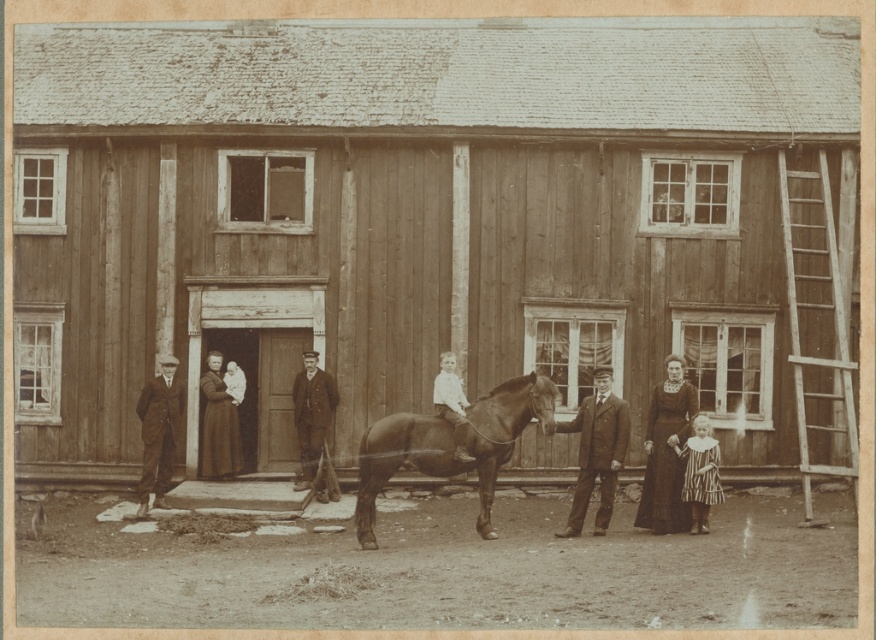
From the picture: You are a photographer standing at the position of the dark brown suit at left. You want to take a photo of the brown glossy horse at center without moving. Can you reach the horse with your camera lens? Assume your camera has a maximum zoom of 200mm and you are using a full frame sensor. The minimum focusing distance of your camera is 1 meter.

The distance between the brown glossy horse at center and dark brown suit at left is 4.37 meters. Since the minimum focusing distance is 1 meter, and the actual distance is 4.37 meters, which is greater than 1 meter, the camera can focus on the brown glossy horse at center. Therefore, you can take the photo without moving.

You are a photographer wanting to capture a closeup shot of both the smooth brown suit at center and the matte black dress at center in the scene. Given that your camera has a maximum focus range of 5 meters, will you be able to include both subjects in the same frame without moving the camera?

The distance between the smooth brown suit at center and the matte black dress at center is 5.71 meters, which exceeds the camera maximum focus range of 5 meters. Therefore, you cannot capture both subjects in the same frame without moving the camera.